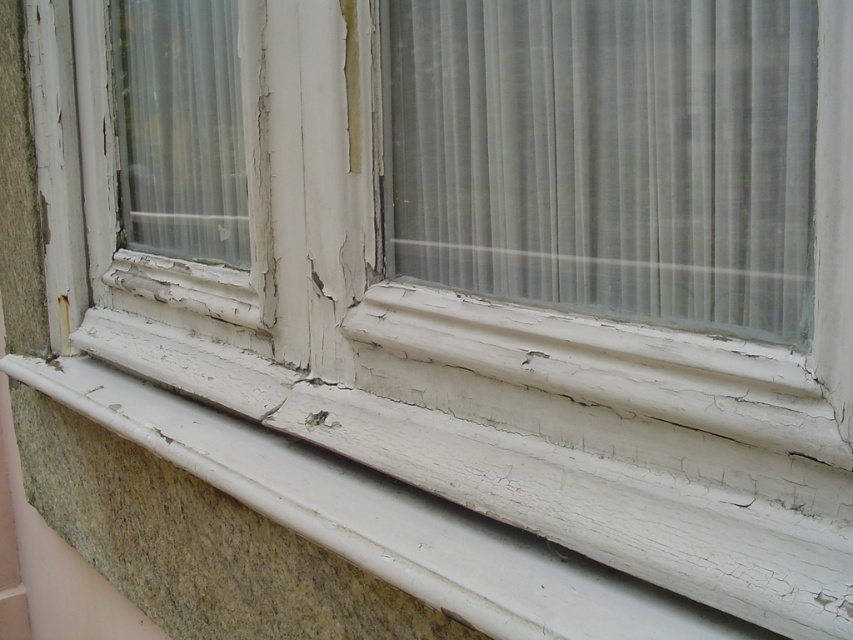
You are standing in a room and want to reach the translucent fabric curtain at center to adjust it. If your outstretched hand can reach up to 60 centimeters, will you be able to touch the curtain?

The translucent fabric curtain at center is 64.46 centimeters away from the viewer. Since your hand can only reach up to 60 centimeters, you will not be able to touch the curtain.

You are a window installer assessing the window for repair. You notice the translucent fabric curtain at center and the white cracked wood at lower center. Which object would be easier to see through?

The translucent fabric curtain at center is thinner than the white cracked wood at lower center, so it would be easier to see through the translucent fabric curtain at center.